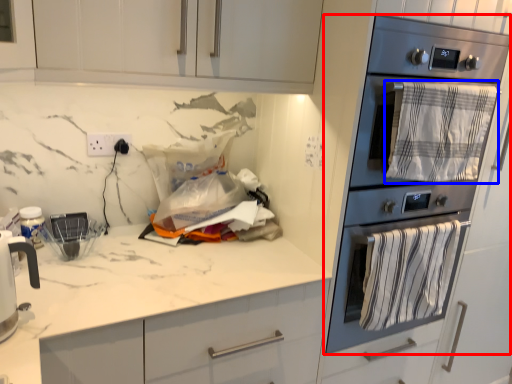
Question: Which of the following is the farthest to the observer, kitchen appliance (highlighted by a red box) or blanket (highlighted by a blue box)?

Choices:
 (A) kitchen appliance
 (B) blanket

Answer: (B)